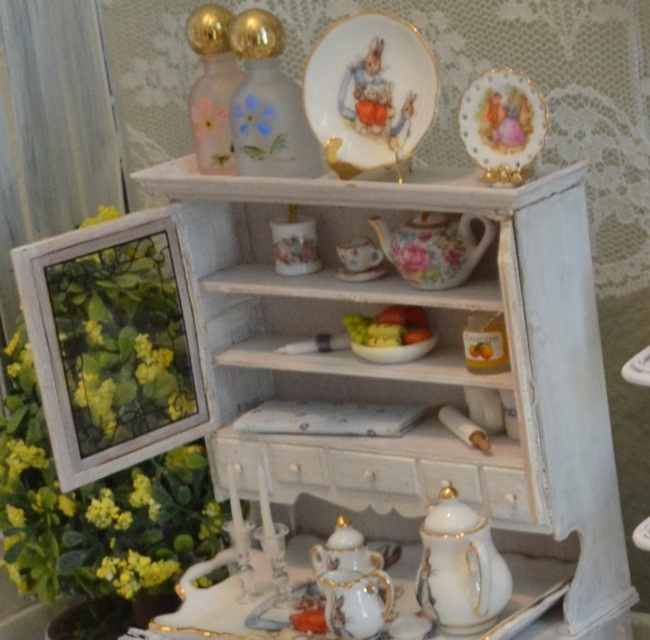
Does white painted wood drawer at center appear on the left side of porcelain tea pot at center?

No, white painted wood drawer at center is not to the left of porcelain tea pot at center.

Which is in front, point (526, 492) or point (378, 557)?

Point (526, 492)

Does point (270, 486) come farther from viewer compared to point (315, 557)?

Yes, point (270, 486) is behind point (315, 557).

Locate an element on the screen. The width and height of the screenshot is (650, 640). white painted wood drawer at center is located at coordinates (382, 472).

Measure the distance between porcelain teapot at lower center and camera.

porcelain teapot at lower center is 1.28 meters away from camera.

Can you confirm if porcelain teapot at lower center is wider than floral porcelain teapot at center?

Yes, porcelain teapot at lower center is wider than floral porcelain teapot at center.

Find the location of a particular element. porcelain teapot at lower center is located at coordinates (211, 609).

Can you confirm if white painted wood cabinet at center is bigger than porcelain teacup at middle?

Correct, white painted wood cabinet at center is larger in size than porcelain teacup at middle.

Who is more distant from viewer, (512, 236) or (369, 266)?

Positioned behind is point (369, 266).

The image size is (650, 640). What do you see at coordinates (419, 371) in the screenshot?
I see `white painted wood cabinet at center` at bounding box center [419, 371].

The height and width of the screenshot is (640, 650). What are the coordinates of `white painted wood cabinet at center` in the screenshot? It's located at (419, 371).